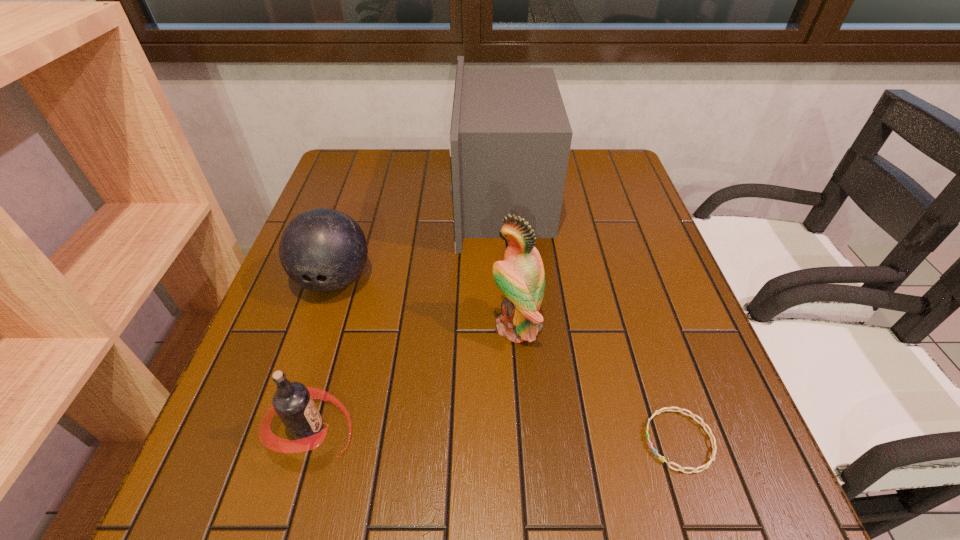
I want to click on vacant area situated 0.250m on the front-facing side of the parrot, so click(371, 327).

I want to click on free region located 0.200m on the front-facing side of the parrot, so click(395, 327).

This screenshot has height=540, width=960. Identify the location of free spot located 0.350m on the grip area of the bowling ball. (270, 477).

The height and width of the screenshot is (540, 960). Identify the location of free spot located on the label of the root beer. point(429,430).

Find the location of a particular element. This screenshot has width=960, height=540. vacant space located on the surface of the shortest object showing star-shaped elements is located at coordinates (563, 441).

Find the location of a particular element. The image size is (960, 540). blank space located 0.230m on the surface of the shortest object showing star-shaped elements is located at coordinates pos(510,441).

Locate an element on the screen. The height and width of the screenshot is (540, 960). vacant space located on the surface of the shortest object showing star-shaped elements is located at coordinates (521, 441).

Find the location of a particular element. object that is at the far edge is located at coordinates (510, 138).

Where is `root beer that is at the near edge`? This screenshot has width=960, height=540. root beer that is at the near edge is located at coordinates (293, 402).

This screenshot has height=540, width=960. I want to click on bracelet that is at the near edge, so click(705, 466).